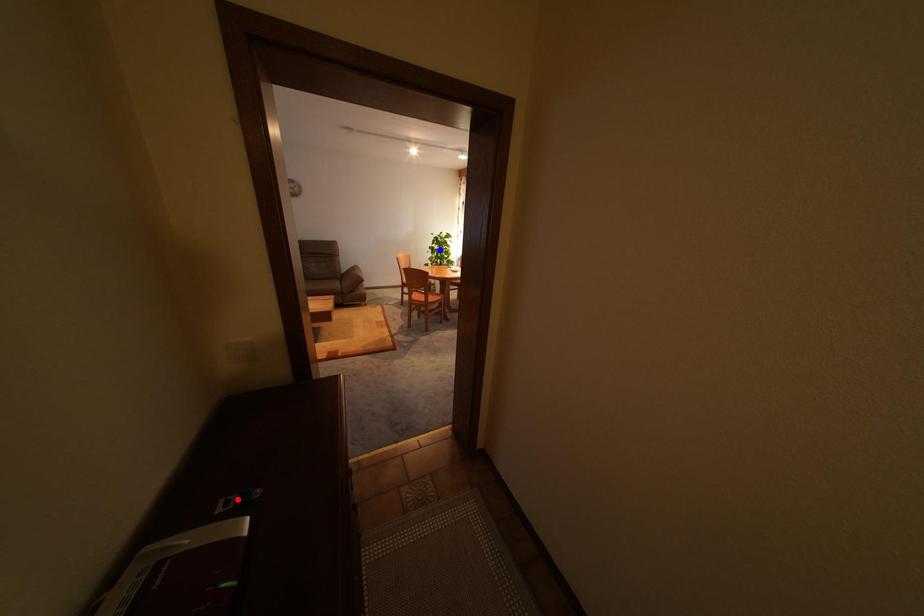
Question: Two points are marked on the image. Which point is closer to the camera?

Choices:
 (A) Blue point is closer.
 (B) Red point is closer.

Answer: (B)